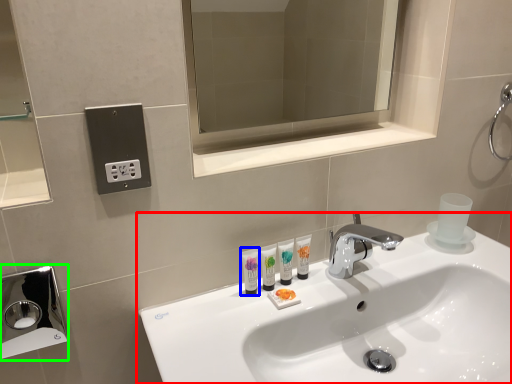
Question: Which object is positioned closest to sink (highlighted by a red box)? Select from mouthwash (highlighted by a blue box) and hand dryer (highlighted by a green box).

Choices:
 (A) mouthwash
 (B) hand dryer

Answer: (A)